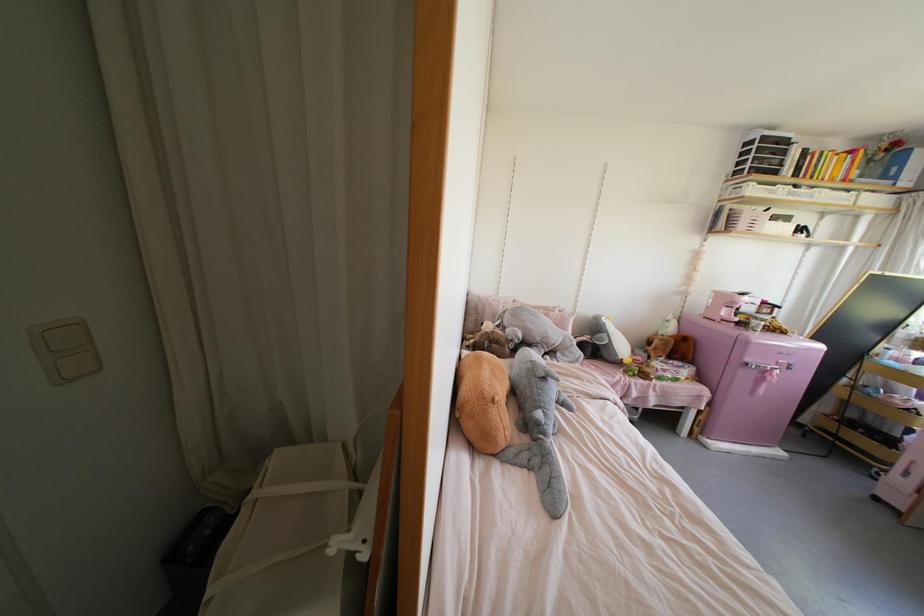
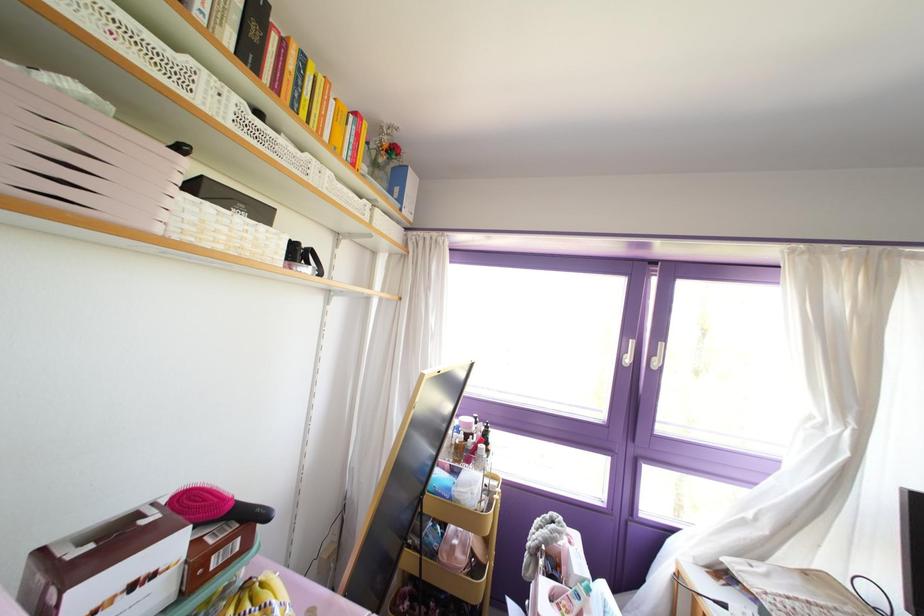
The point at [869,160] is marked in the first image. Where is the corresponding point in the second image?

(372, 163)